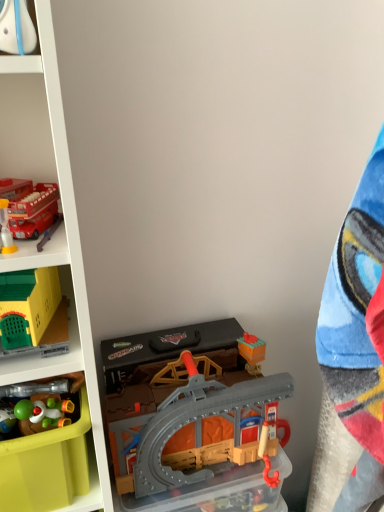
Question: Which is correct: translucent plastic storage box at center, which is the first storage box in right-to-left order, is inside matte red bus at upper left, which ranks as the fourth toy in left-to-right order, or outside of it?

Choices:
 (A) outside
 (B) inside

Answer: (A)

Question: Relative to matte red bus at upper left, marked as the second toy in a right-to-left arrangement, is translucent plastic storage box at center, which is the 2th storage box from left to right, in front or behind?

Choices:
 (A) front
 (B) behind

Answer: (B)

Question: Which object is the closest to the translucent plastic storage box at center, which is the 2th storage box from left to right?

Choices:
 (A) shiny plastic toy at lower left, the third toy viewed from the left
 (B) translucent yellow bottle at upper left, which ranks as the 2th toy in left-to-right order
 (C) plastic/grey track at lower center, which is the first toy in right-to-left order
 (D) matte green plastic storage box at lower left, the first storage box when ordered from left to right
 (E) yellow plastic playhouse at left, arranged as the first toy when viewed from the left

Answer: (C)

Question: Considering the real-world distances, which object is farthest from the translucent yellow bottle at upper left, placed as the fourth toy when sorted from right to left?

Choices:
 (A) plastic/grey track at lower center, positioned as the 5th toy in left-to-right order
 (B) plastic yellow toy storage at left
 (C) matte red bus at upper left, marked as the second toy in a right-to-left arrangement
 (D) translucent plastic storage box at center, which is the first storage box in right-to-left order
 (E) shiny plastic toy at lower left, the 3th toy from the right

Answer: (D)